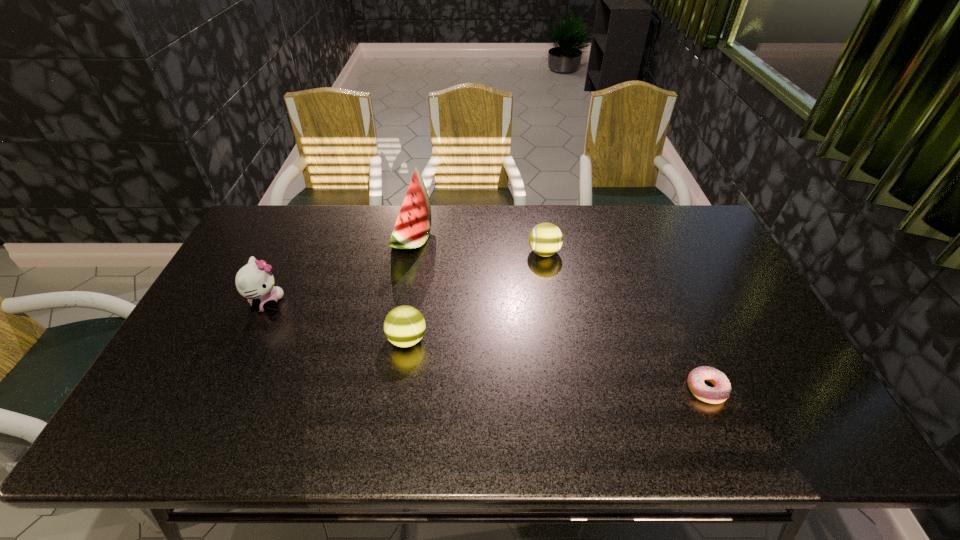
You are a GUI agent. You are given a task and a screenshot of the screen. Output one action in this format:
    pyautogui.click(x=<x>, y=<y>)
    Task: Click on the watermelon
    The image size is (960, 540).
    Given the screenshot: What is the action you would take?
    pyautogui.click(x=412, y=228)

At what (x,y) coordinates should I click in order to perform the action: click on the leftmost object. Please return your answer as a coordinate pair (x, y). The image size is (960, 540). Looking at the image, I should click on (254, 281).

The width and height of the screenshot is (960, 540). What are the coordinates of `the fourth shortest object` in the screenshot? It's located at (254, 281).

Identify the location of the second object from right to left. This screenshot has height=540, width=960. (545, 239).

Where is `the farther tennis ball`? Image resolution: width=960 pixels, height=540 pixels. the farther tennis ball is located at coordinates (545, 239).

Identify the location of the left tennis ball. This screenshot has width=960, height=540. (404, 326).

Identify the location of the second nearest object. (404, 326).

You are a GUI agent. You are given a task and a screenshot of the screen. Output one action in this format:
    pyautogui.click(x=<x>, y=<y>)
    Task: Click on the nearest object
    The width and height of the screenshot is (960, 540).
    Given the screenshot: What is the action you would take?
    pyautogui.click(x=720, y=392)

The width and height of the screenshot is (960, 540). I want to click on the rightmost object, so click(x=720, y=392).

Identify the location of vacant space situated 0.050m on the outer rind of the tallest object. The image size is (960, 540). (445, 238).